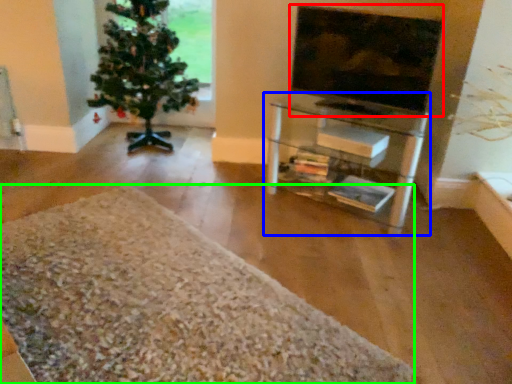
Question: Estimate the real-world distances between objects in this image. Which object is farther from television (highlighted by a red box), shelf (highlighted by a blue box) or gravel (highlighted by a green box)?

Choices:
 (A) shelf
 (B) gravel

Answer: (B)